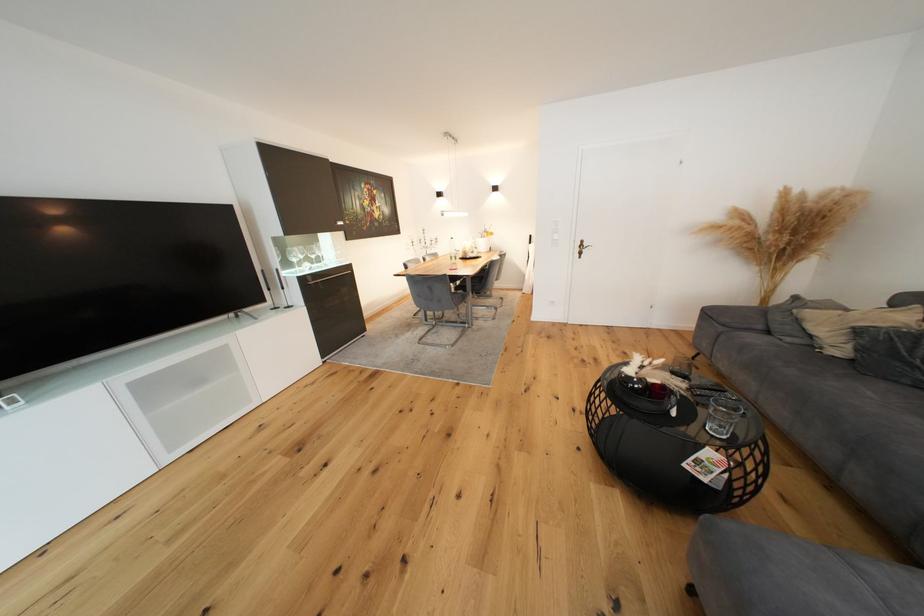
Locate an element on the screen. The height and width of the screenshot is (616, 924). black TV remote is located at coordinates (708, 389).